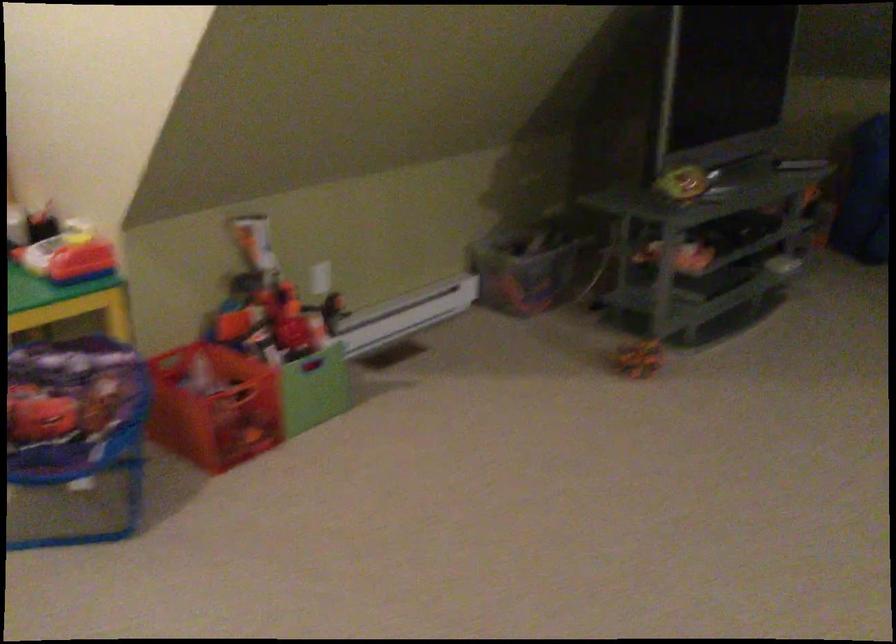
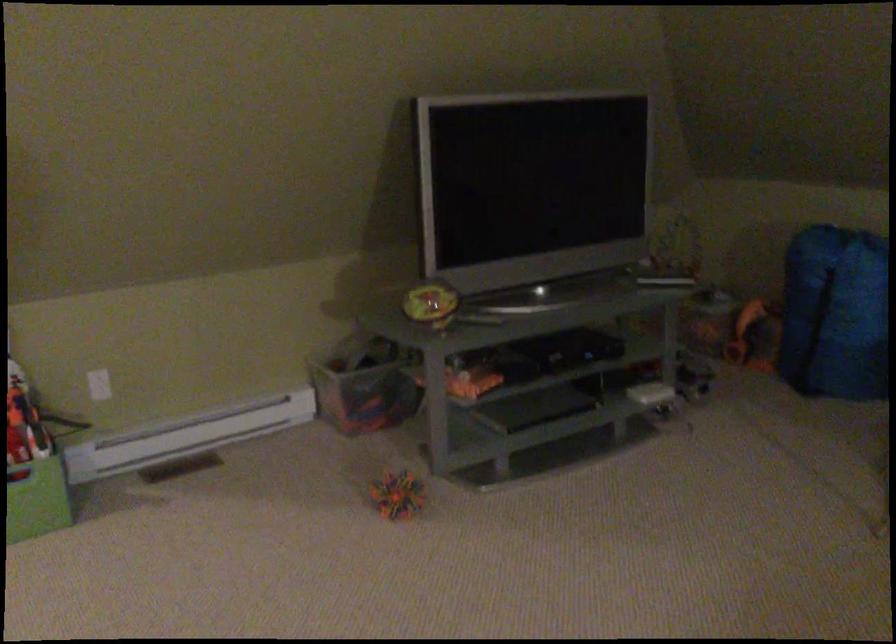
The point at (289, 317) is marked in the first image. Where is the corresponding point in the second image?

(23, 426)